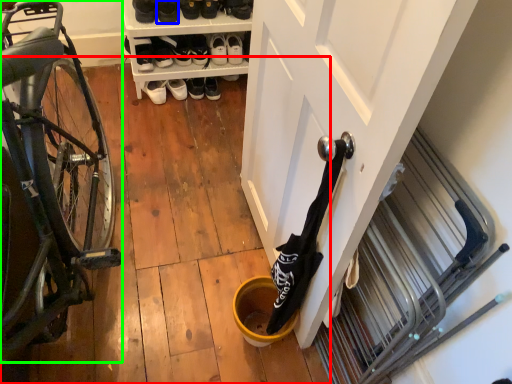
Question: Which object is the closest to the wood (highlighted by a red box)? Choose among these: footwear (highlighted by a blue box) or bicycle (highlighted by a green box).

Choices:
 (A) footwear
 (B) bicycle

Answer: (B)